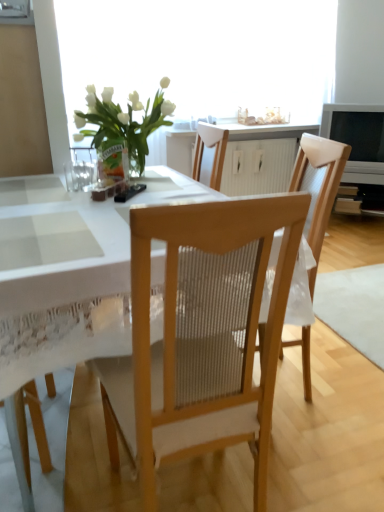
Where is `vacant space to the right of clear glass vase at center`? vacant space to the right of clear glass vase at center is located at coordinates (145, 181).